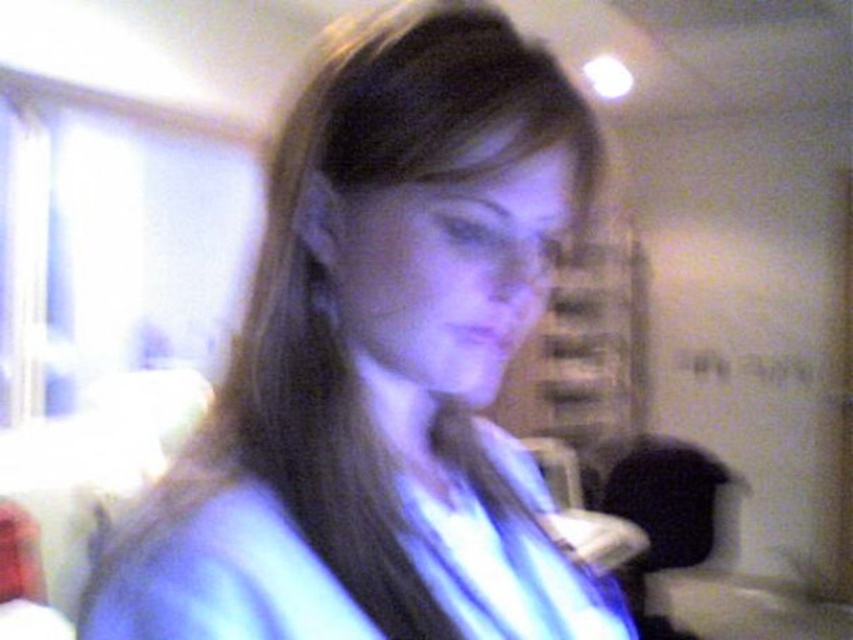
Question: Does blue fabric shirt at center appear under blue fabric robe at center?

Choices:
 (A) yes
 (B) no

Answer: (B)

Question: Does blue fabric shirt at center appear over blue fabric robe at center?

Choices:
 (A) yes
 (B) no

Answer: (A)

Question: Among these objects, which one is farthest from the camera?

Choices:
 (A) blue fabric robe at center
 (B) blue fabric shirt at center

Answer: (A)

Question: Which object appears closest to the camera in this image?

Choices:
 (A) blue fabric robe at center
 (B) blue fabric shirt at center

Answer: (B)

Question: Which of the following is the farthest from the observer?

Choices:
 (A) (242, 449)
 (B) (80, 632)

Answer: (A)

Question: Is blue fabric shirt at center smaller than blue fabric robe at center?

Choices:
 (A) yes
 (B) no

Answer: (B)